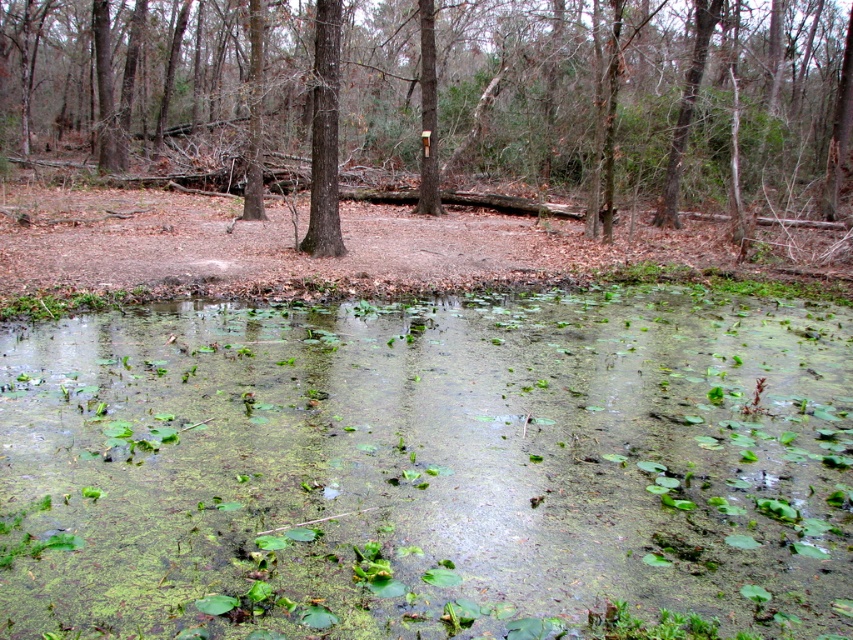
Question: Which object appears farthest from the camera in this image?

Choices:
 (A) green algae-covered water at center
 (B) brown rough tree at center
 (C) brown wood tree at center

Answer: (C)

Question: Does green algae-covered water at center have a larger size compared to brown rough tree at center?

Choices:
 (A) no
 (B) yes

Answer: (B)

Question: Which object appears closest to the camera in this image?

Choices:
 (A) brown wood tree at center
 (B) brown rough tree at center

Answer: (B)

Question: Can you confirm if green algae-covered water at center is positioned to the left of brown wood tree at center?

Choices:
 (A) yes
 (B) no

Answer: (B)

Question: Does green algae-covered water at center appear on the right side of brown wood tree at center?

Choices:
 (A) yes
 (B) no

Answer: (A)

Question: Which object is farther from the camera taking this photo?

Choices:
 (A) brown wood tree at center
 (B) green algae-covered water at center
 (C) brown rough tree at center

Answer: (A)